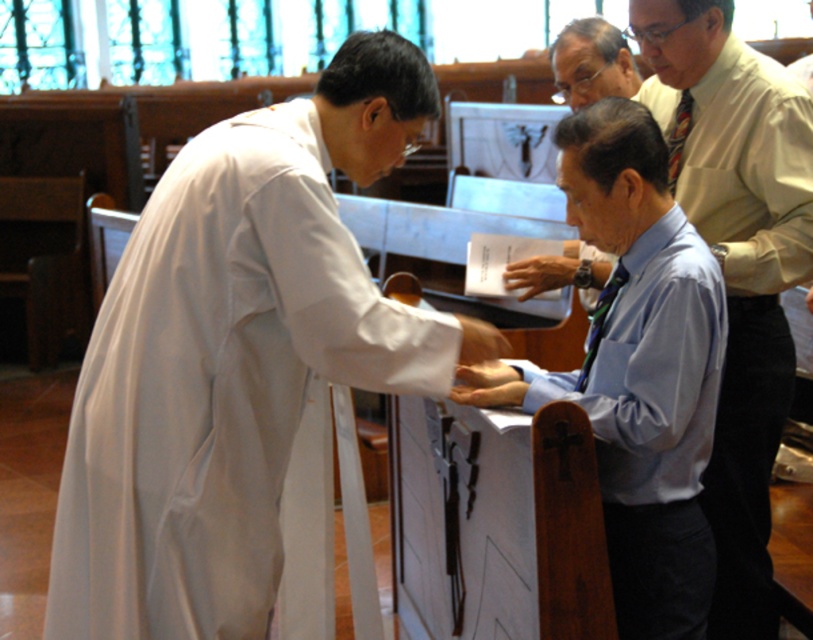
At what (x,y) coordinates should I click in order to perform the action: click on white matte/soft robe at center. Please return your answer as a coordinate pair (x, y). Looking at the image, I should click on (225, 396).

Between white matte/soft robe at center and white matte robe at upper right, which one is positioned higher?

white matte robe at upper right is higher up.

Describe the element at coordinates (225, 396) in the screenshot. I see `white matte/soft robe at center` at that location.

Find the location of a particular element. This screenshot has width=813, height=640. white matte/soft robe at center is located at coordinates (225, 396).

Is point (183, 189) more distant than point (720, 285)?

No, (183, 189) is in front of (720, 285).

Which is behind, point (187, 637) or point (629, 612)?

Positioned behind is point (629, 612).

Find the location of `white matte/soft robe at center`. white matte/soft robe at center is located at coordinates (225, 396).

Is white matte robe at upper right thinner than white matte robe at lower center?

In fact, white matte robe at upper right might be wider than white matte robe at lower center.

I want to click on white matte robe at upper right, so click(738, 275).

I want to click on white matte robe at upper right, so click(738, 275).